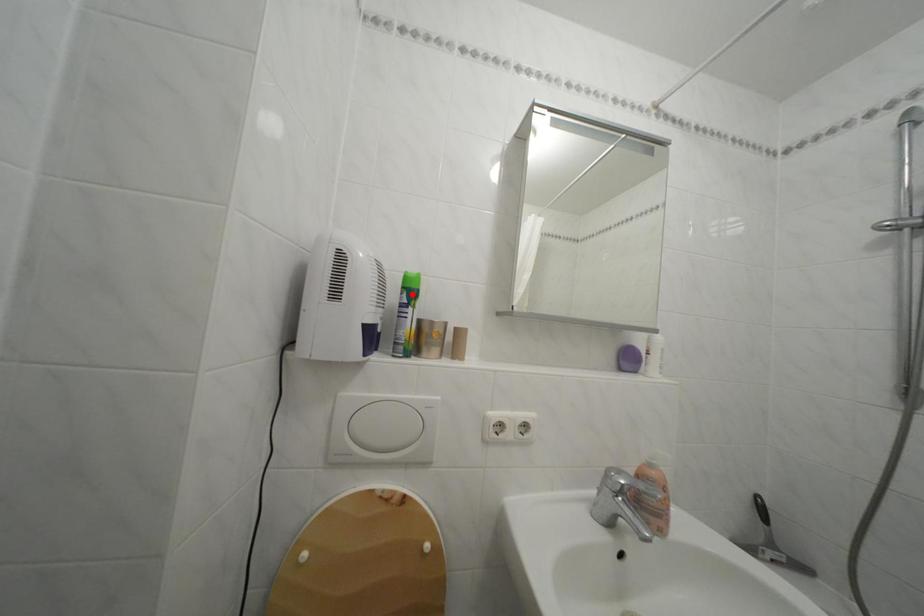
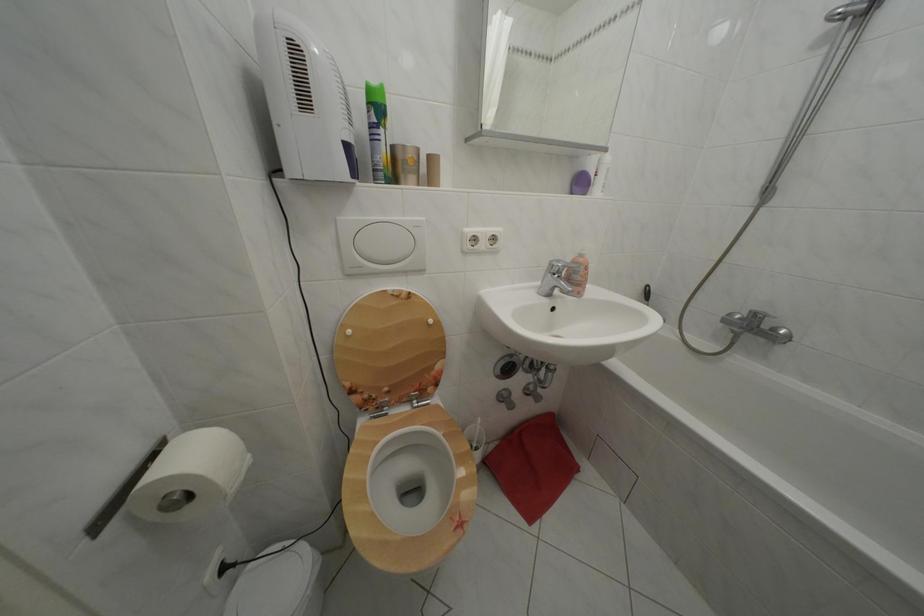
The point at the highlighted location is marked in the first image. Where is the corresponding point in the second image?

(378, 110)